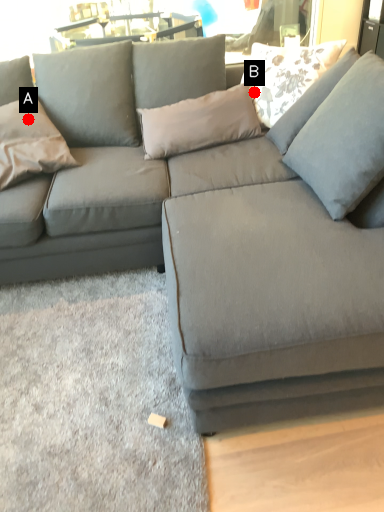
Question: Two points are circled on the image, labeled by A and B beside each circle. Which point is further to the camera?

Choices:
 (A) A is further
 (B) B is further

Answer: (B)